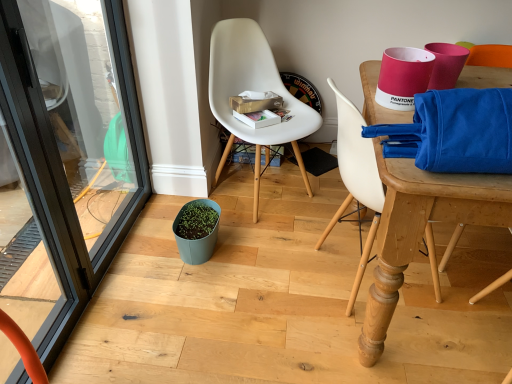
What is the approximate width of black glass screen door at left?

black glass screen door at left is 3.76 inches wide.

The image size is (512, 384). I want to click on white plastic chair at center, placed as the 1th chair when sorted from left to right, so click(x=255, y=90).

The width and height of the screenshot is (512, 384). Identify the location of black glass screen door at left. click(x=65, y=156).

Is white plastic chair at upper right, the 2th chair viewed from the left, further to camera compared to black glass screen door at left?

Yes, it is behind black glass screen door at left.

Are white plastic chair at upper right, marked as the 1th chair in a right-to-left arrangement, and black glass screen door at left making contact?

No, white plastic chair at upper right, marked as the 1th chair in a right-to-left arrangement, is not touching black glass screen door at left.

Considering the sizes of objects white plastic chair at upper right, marked as the 1th chair in a right-to-left arrangement, and black glass screen door at left in the image provided, who is bigger, white plastic chair at upper right, marked as the 1th chair in a right-to-left arrangement, or black glass screen door at left?

With larger size is white plastic chair at upper right, marked as the 1th chair in a right-to-left arrangement.

Can you confirm if white plastic chair at upper right, marked as the 1th chair in a right-to-left arrangement, is wider than black glass screen door at left?

Indeed, white plastic chair at upper right, marked as the 1th chair in a right-to-left arrangement, has a greater width compared to black glass screen door at left.

Considering the relative sizes of teal matte flowerpot at center and white plastic chair at center, placed as the 1th chair when sorted from left to right, in the image provided, is teal matte flowerpot at center bigger than white plastic chair at center, placed as the 1th chair when sorted from left to right,?

No.

Is teal matte flowerpot at center positioned beyond the bounds of white plastic chair at center, placed as the 1th chair when sorted from left to right?

Yes, teal matte flowerpot at center is not within white plastic chair at center, placed as the 1th chair when sorted from left to right.

Is teal matte flowerpot at center positioned far away from white plastic chair at center, which is the second chair from right to left?

No, teal matte flowerpot at center is in close proximity to white plastic chair at center, which is the second chair from right to left.

From the image's perspective, is teal matte flowerpot at center above or below white plastic chair at center, placed as the 1th chair when sorted from left to right?

teal matte flowerpot at center is below white plastic chair at center, placed as the 1th chair when sorted from left to right.

Can we say white plastic chair at center, placed as the 1th chair when sorted from left to right, lies outside teal matte flowerpot at center?

white plastic chair at center, placed as the 1th chair when sorted from left to right, is positioned outside teal matte flowerpot at center.

Can you confirm if white plastic chair at center, which is the second chair from right to left, is bigger than teal matte flowerpot at center?

Yes.

Considering the relative positions of white plastic chair at center, placed as the 1th chair when sorted from left to right, and teal matte flowerpot at center in the image provided, is white plastic chair at center, placed as the 1th chair when sorted from left to right, to the left of teal matte flowerpot at center from the viewer's perspective?

Incorrect, white plastic chair at center, placed as the 1th chair when sorted from left to right, is not on the left side of teal matte flowerpot at center.

Consider the image. Which object is wider, white plastic chair at upper right, marked as the 1th chair in a right-to-left arrangement, or white plastic chair at center, which is the second chair from right to left?

white plastic chair at center, which is the second chair from right to left.

Who is more distant, white plastic chair at upper right, marked as the 1th chair in a right-to-left arrangement, or white plastic chair at center, placed as the 1th chair when sorted from left to right?

white plastic chair at center, placed as the 1th chair when sorted from left to right.

Is white plastic chair at upper right, marked as the 1th chair in a right-to-left arrangement, turned away from white plastic chair at center, which is the second chair from right to left?

That's not correct — white plastic chair at upper right, marked as the 1th chair in a right-to-left arrangement, is not looking away from white plastic chair at center, which is the second chair from right to left.

From a real-world perspective, is white plastic chair at upper right, the 2th chair viewed from the left, positioned under white plastic chair at center, which is the second chair from right to left, based on gravity?

Yes.

In the scene shown: Considering the positions of objects teal matte flowerpot at center and black glass screen door at left in the image provided, who is behind, teal matte flowerpot at center or black glass screen door at left?

teal matte flowerpot at center.

From the picture: How different are the orientations of teal matte flowerpot at center and black glass screen door at left in degrees?

4.55 degrees.

From the image's perspective, who appears lower, teal matte flowerpot at center or black glass screen door at left?

teal matte flowerpot at center is shown below in the image.

Which of these two, teal matte flowerpot at center or black glass screen door at left, stands shorter?

teal matte flowerpot at center is shorter.

Between white plastic chair at center, placed as the 1th chair when sorted from left to right, and black glass screen door at left, which one has larger size?

white plastic chair at center, placed as the 1th chair when sorted from left to right, is bigger.

Is point (245, 129) more distant than point (73, 262)?

Yes, point (245, 129) is farther from viewer.

From the image's perspective, relative to black glass screen door at left, is white plastic chair at center, which is the second chair from right to left, above or below?

white plastic chair at center, which is the second chair from right to left, is above black glass screen door at left.

Which object is closer to the camera taking this photo, white plastic chair at upper right, the 2th chair viewed from the left, or teal matte flowerpot at center?

white plastic chair at upper right, the 2th chair viewed from the left.

Which is farther, [343,209] or [179,211]?

The point [179,211] is farther.

From their relative heights in the image, would you say white plastic chair at upper right, marked as the 1th chair in a right-to-left arrangement, is taller or shorter than teal matte flowerpot at center?

Considering their sizes, white plastic chair at upper right, marked as the 1th chair in a right-to-left arrangement, has more height than teal matte flowerpot at center.

Consider the image. Could teal matte flowerpot at center be considered to be inside white plastic chair at upper right, the 2th chair viewed from the left?

No, teal matte flowerpot at center is not surrounded by white plastic chair at upper right, the 2th chair viewed from the left.

Which chair is the 1st one when counting from the back of the black glass screen door at left? Please provide its 2D coordinates.

[(356, 178)]

I want to click on flowerpot below the white plastic chair at center, placed as the 1th chair when sorted from left to right (from the image's perspective), so click(197, 239).

From the image, which object appears to be nearer to white plastic chair at center, which is the second chair from right to left, teal matte flowerpot at center or white plastic chair at upper right, the 2th chair viewed from the left?

teal matte flowerpot at center is positioned closer to the anchor white plastic chair at center, which is the second chair from right to left.

Estimate the real-world distances between objects in this image. Which object is further from black glass screen door at left, white plastic chair at upper right, marked as the 1th chair in a right-to-left arrangement, or teal matte flowerpot at center?

white plastic chair at upper right, marked as the 1th chair in a right-to-left arrangement, is further to black glass screen door at left.

Based on their spatial positions, is white plastic chair at upper right, marked as the 1th chair in a right-to-left arrangement, or black glass screen door at left closer to white plastic chair at center, placed as the 1th chair when sorted from left to right?

Based on the image, white plastic chair at upper right, marked as the 1th chair in a right-to-left arrangement, appears to be nearer to white plastic chair at center, placed as the 1th chair when sorted from left to right.

From the picture: Looking at the image, which one is located further to white plastic chair at center, which is the second chair from right to left, black glass screen door at left or white plastic chair at upper right, marked as the 1th chair in a right-to-left arrangement?

black glass screen door at left is further to white plastic chair at center, which is the second chair from right to left.

From the picture: Based on their spatial positions, is white plastic chair at center, which is the second chair from right to left, or white plastic chair at upper right, marked as the 1th chair in a right-to-left arrangement, closer to teal matte flowerpot at center?

white plastic chair at center, which is the second chair from right to left.

Which object lies nearer to the anchor point white plastic chair at center, placed as the 1th chair when sorted from left to right, teal matte flowerpot at center or black glass screen door at left?

teal matte flowerpot at center lies closer to white plastic chair at center, placed as the 1th chair when sorted from left to right, than the other object.

Looking at the image, which one is located further to white plastic chair at upper right, marked as the 1th chair in a right-to-left arrangement, teal matte flowerpot at center or white plastic chair at center, placed as the 1th chair when sorted from left to right?

teal matte flowerpot at center is positioned further to the anchor white plastic chair at upper right, marked as the 1th chair in a right-to-left arrangement.

When comparing their distances from white plastic chair at upper right, marked as the 1th chair in a right-to-left arrangement, does white plastic chair at center, which is the second chair from right to left, or black glass screen door at left seem closer?

white plastic chair at center, which is the second chair from right to left.

Where is `chair between black glass screen door at left and white plastic chair at upper right, marked as the 1th chair in a right-to-left arrangement, in the horizontal direction`? chair between black glass screen door at left and white plastic chair at upper right, marked as the 1th chair in a right-to-left arrangement, in the horizontal direction is located at coordinates (255, 90).

The image size is (512, 384). In order to click on flowerpot situated between black glass screen door at left and white plastic chair at upper right, marked as the 1th chair in a right-to-left arrangement, from left to right in this screenshot , I will do `click(197, 239)`.

The image size is (512, 384). What are the coordinates of `chair situated between teal matte flowerpot at center and white plastic chair at upper right, marked as the 1th chair in a right-to-left arrangement, from left to right` in the screenshot? It's located at (255, 90).